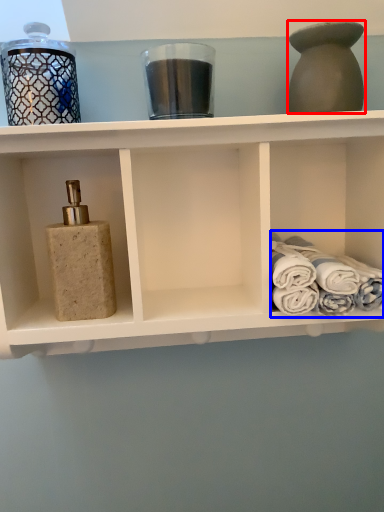
Question: Which object is further to the camera taking this photo, bottle (highlighted by a red box) or bath towel (highlighted by a blue box)?

Choices:
 (A) bottle
 (B) bath towel

Answer: (B)